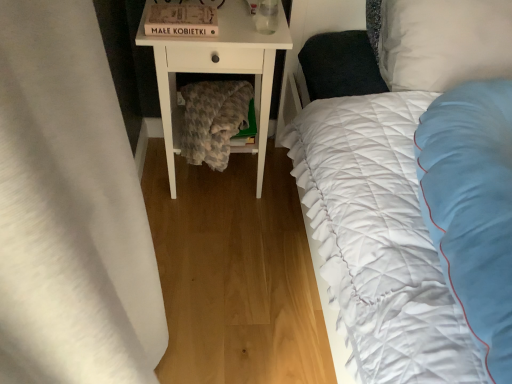
Question: From the image's perspective, is fuzzy gray blanket at lower center located above or below clear glass at upper center?

Choices:
 (A) below
 (B) above

Answer: (A)

Question: Considering their positions, is fuzzy gray blanket at lower center located in front of or behind clear glass at upper center?

Choices:
 (A) behind
 (B) front

Answer: (A)

Question: Estimate the real-world distances between objects in this image. Which object is farther from the white soft pillow at upper right?

Choices:
 (A) white quilted bed at right
 (B) white matte nightstand at center
 (C) white fabric curtain at left
 (D) matte cardboard box at upper center
 (E) clear glass at upper center

Answer: (C)

Question: Estimate the real-world distances between objects in this image. Which object is closer to the white soft pillow at upper right?

Choices:
 (A) clear glass at upper center
 (B) fuzzy gray blanket at lower center
 (C) matte cardboard box at upper center
 (D) white matte nightstand at center
 (E) white fabric curtain at left

Answer: (A)